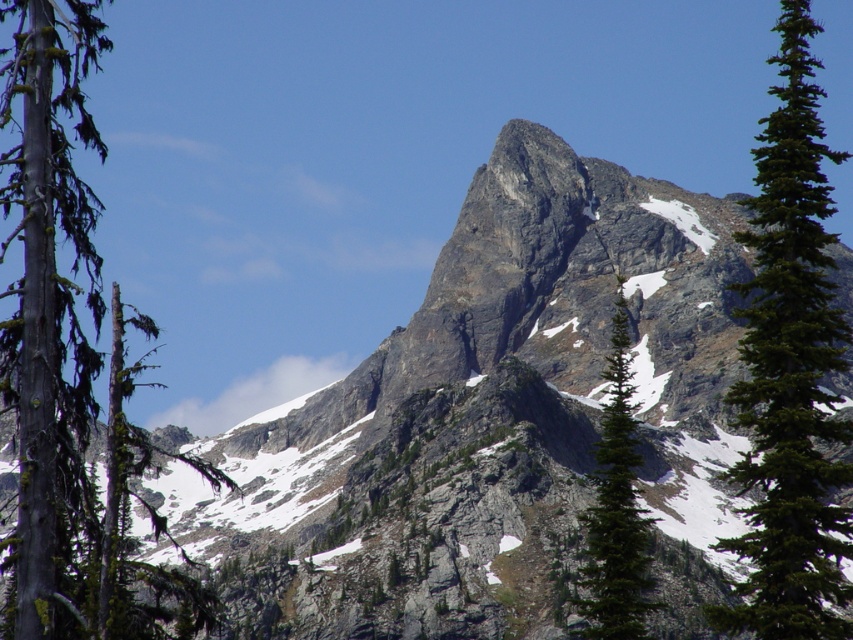
Consider the image. You are standing in front of the mountain and see the green coniferous tree at right and the green textured pine tree at center. Which tree is located to the east if the mountain peak is pointing north?

The green coniferous tree at right is positioned on the right side of the green textured pine tree at center. Since the mountain peak points north, the right side would correspond to the east direction. Therefore, the green coniferous tree at right is located to the east.

You are standing at the base of the mountain and want to reach the point marked at coordinates point (47,422). If your hiking gear allows you to climb slopes up to 45 degrees, can you safely reach that point?

The point marked at coordinates point (47,422) is 80.99 meters away from the camera. However, the question about the slope angle isn not addressed in the provided information. The scene description mentions the mountain has a sharp and pointed peak with rugged surfaces, but there is no specific data on the slope angle at that particular point. Therefore, it is impossible to determine if the slope is within your gear limit of 45 degrees based on the given details.

You are standing in front of the mountain and want to take a photo that includes both the green mossy tree trunk at left and the green coniferous tree at right. Which tree should you position closer to the center of the frame to ensure both are visible?

You should position the green coniferous tree at right closer to the center of the frame because the green mossy tree trunk at left is already positioned to the left of it, so moving the coniferous tree towards the center will allow both trees to be within the frame.